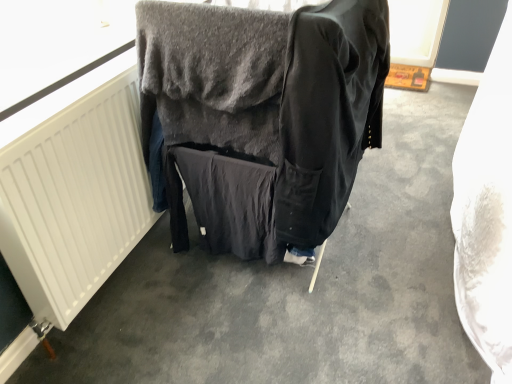
Question: Does black cotton jacket at center appear on the left side of dark gray fabric at center?

Choices:
 (A) no
 (B) yes

Answer: (A)

Question: Does black cotton jacket at center come behind dark gray fabric at center?

Choices:
 (A) no
 (B) yes

Answer: (A)

Question: Is black cotton jacket at center wider than dark gray fabric at center?

Choices:
 (A) yes
 (B) no

Answer: (B)

Question: Is black cotton jacket at center not within dark gray fabric at center?

Choices:
 (A) yes
 (B) no

Answer: (B)

Question: Is black cotton jacket at center positioned before dark gray fabric at center?

Choices:
 (A) no
 (B) yes

Answer: (B)

Question: Considering the positions of dark gray fabric at center and black cotton jacket at center in the image, is dark gray fabric at center bigger or smaller than black cotton jacket at center?

Choices:
 (A) big
 (B) small

Answer: (A)

Question: Which is correct: dark gray fabric at center is inside black cotton jacket at center, or outside of it?

Choices:
 (A) outside
 (B) inside

Answer: (A)

Question: Is dark gray fabric at center to the left or to the right of black cotton jacket at center in the image?

Choices:
 (A) right
 (B) left

Answer: (B)

Question: Considering the positions of point [167, 201] and point [352, 57], is point [167, 201] closer or farther from the camera than point [352, 57]?

Choices:
 (A) closer
 (B) farther

Answer: (B)

Question: Would you say dark gray fabric at center is to the left or to the right of white matte radiator at left in the picture?

Choices:
 (A) right
 (B) left

Answer: (A)

Question: In terms of width, does dark gray fabric at center look wider or thinner when compared to white matte radiator at left?

Choices:
 (A) wide
 (B) thin

Answer: (A)

Question: Choose the correct answer: Is dark gray fabric at center inside white matte radiator at left or outside it?

Choices:
 (A) outside
 (B) inside

Answer: (A)

Question: In the image, is dark gray fabric at center positioned in front of or behind white matte radiator at left?

Choices:
 (A) behind
 (B) front

Answer: (A)

Question: From a real-world perspective, is black cotton jacket at center above or below white matte radiator at left?

Choices:
 (A) below
 (B) above

Answer: (B)

Question: In the image, is black cotton jacket at center on the left side or the right side of white matte radiator at left?

Choices:
 (A) left
 (B) right

Answer: (B)